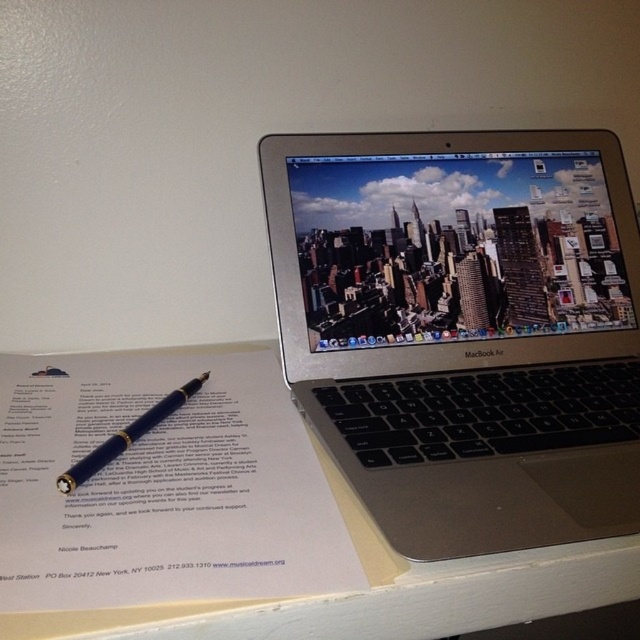
Question: Does white matte table at center appear over blue polished pen at lower left?

Choices:
 (A) yes
 (B) no

Answer: (B)

Question: Is silver metallic laptop at upper right to the right of blue polished pen at lower left from the viewer's perspective?

Choices:
 (A) yes
 (B) no

Answer: (A)

Question: Among these points, which one is farthest from the camera?

Choices:
 (A) (461, 179)
 (B) (80, 477)

Answer: (A)

Question: Where is silver metallic laptop at upper right located in relation to white matte table at center in the image?

Choices:
 (A) above
 (B) below

Answer: (A)

Question: Estimate the real-world distances between objects in this image. Which object is closer to the silver metallic laptop at upper right?

Choices:
 (A) blue polished pen at lower left
 (B) white matte table at center

Answer: (B)

Question: Which of the following is the farthest from the observer?

Choices:
 (A) white matte table at center
 (B) blue polished pen at lower left

Answer: (B)